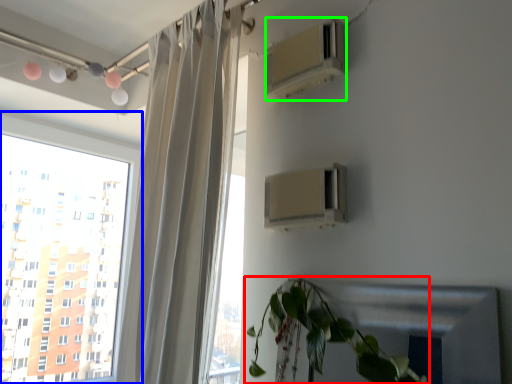
Question: Which object is positioned farthest from houseplant (highlighted by a red box)? Select from window (highlighted by a blue box) and air conditioning (highlighted by a green box).

Choices:
 (A) window
 (B) air conditioning

Answer: (A)